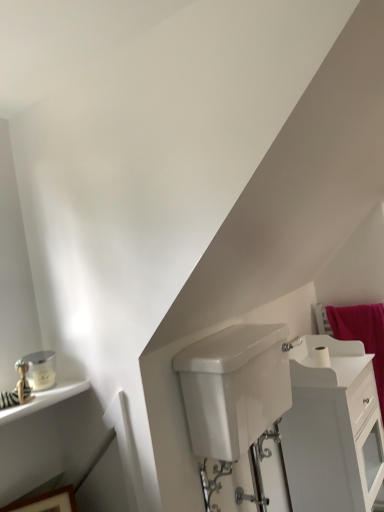
Find the location of `vacant area on top of white glossy tank at lower center (from a real-world perspective)`. vacant area on top of white glossy tank at lower center (from a real-world perspective) is located at coordinates (235, 339).